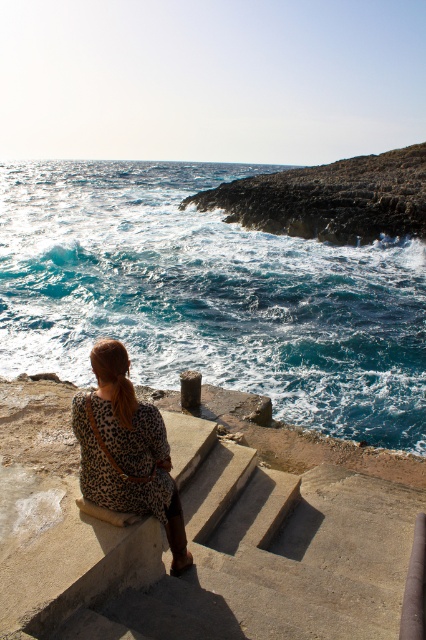
Question: Can you confirm if concrete ledge at lower left is wider than leopard print dress at center?

Choices:
 (A) no
 (B) yes

Answer: (B)

Question: Which point appears closest to the camera in this image?

Choices:
 (A) (103, 449)
 (B) (135, 364)

Answer: (A)

Question: Does concrete ledge at lower left appear on the right side of leopard print dress at center?

Choices:
 (A) yes
 (B) no

Answer: (A)

Question: Which point appears farthest from the camera in this image?

Choices:
 (A) (416, 298)
 (B) (172, 515)
 (C) (267, 596)

Answer: (A)

Question: Among these points, which one is farthest from the camera?

Choices:
 (A) (155, 605)
 (B) (314, 326)

Answer: (B)

Question: Can you confirm if concrete ledge at lower left is bigger than leopard print dress at center?

Choices:
 (A) yes
 (B) no

Answer: (A)